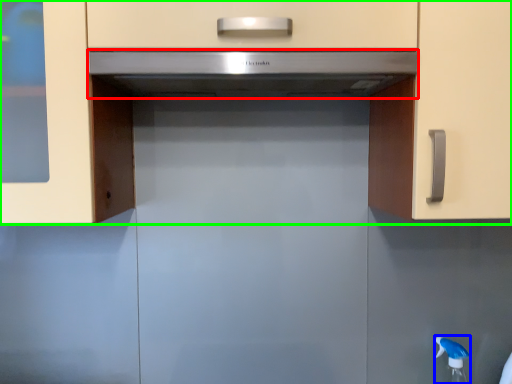
Question: Which is farther away from home appliance (highlighted by a red box)? faucet (highlighted by a blue box) or cabinetry (highlighted by a green box)?

Choices:
 (A) faucet
 (B) cabinetry

Answer: (A)